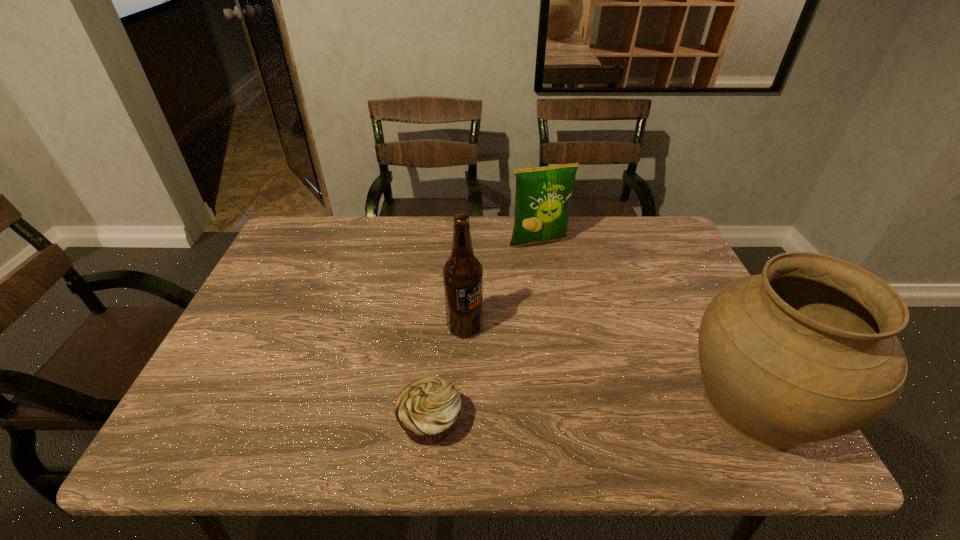
This screenshot has width=960, height=540. I want to click on free region located 0.250m on the label of the third nearest object, so click(x=553, y=404).

At what (x,y) coordinates should I click in order to perform the action: click on vacant space situated 0.200m on the label of the third nearest object. Please return your answer as a coordinate pair (x, y). Looking at the image, I should click on (536, 389).

At what (x,y) coordinates should I click in order to perform the action: click on object that is at the far edge. Please return your answer as a coordinate pair (x, y). Looking at the image, I should click on (543, 194).

Locate an element on the screen. muffin at the near edge is located at coordinates (427, 409).

Find the location of a particular element. This screenshot has width=960, height=540. urn located at the near edge is located at coordinates (807, 351).

You are a GUI agent. You are given a task and a screenshot of the screen. Output one action in this format:
    pyautogui.click(x=<x>, y=<y>)
    Task: Click on the object located in the right edge section of the desktop
    The height and width of the screenshot is (540, 960).
    Given the screenshot: What is the action you would take?
    (807, 351)

This screenshot has height=540, width=960. In order to click on object located at the near right corner in this screenshot , I will do `click(807, 351)`.

You are a GUI agent. You are given a task and a screenshot of the screen. Output one action in this format:
    pyautogui.click(x=<x>, y=<y>)
    Task: Click on the free space at the far edge of the desktop
    
    Given the screenshot: What is the action you would take?
    pyautogui.click(x=614, y=240)

The width and height of the screenshot is (960, 540). Identify the location of free point at the near edge. (309, 387).

What are the coordinates of `vacant space at the left edge` in the screenshot? It's located at (260, 333).